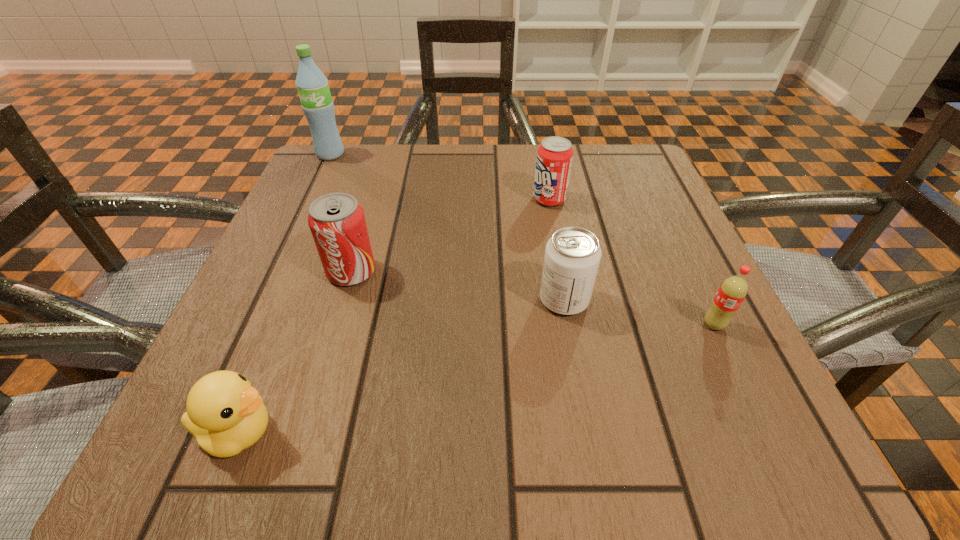
The width and height of the screenshot is (960, 540). Find the location of `free spot between the duck and the water bottle`. free spot between the duck and the water bottle is located at coordinates (284, 293).

This screenshot has width=960, height=540. Find the location of `free space between the nearest object and the tallest object`. free space between the nearest object and the tallest object is located at coordinates (284, 293).

You are a GUI agent. You are given a task and a screenshot of the screen. Output one action in this format:
    pyautogui.click(x=<x>, y=<y>)
    Task: Click on the unoccupied position between the duck and the leftmost soda
    
    Given the screenshot: What is the action you would take?
    pyautogui.click(x=295, y=352)

The width and height of the screenshot is (960, 540). I want to click on vacant area that lies between the rightmost soda and the farthest soda, so 632,262.

The height and width of the screenshot is (540, 960). Find the location of `free space between the tallest object and the rightmost object`. free space between the tallest object and the rightmost object is located at coordinates click(522, 239).

Locate which object ranks fourth in proximity to the leftmost soda. Please provide its 2D coordinates. Your answer should be formatted as a tuple, i.e. [(x, y)], where the tuple contains the x and y coordinates of a point satisfying the conditions above.

[(312, 85)]

Find the location of a particular element. object that stands as the second closest to the water bottle is located at coordinates (554, 157).

Where is `soda identified as the third closest to the rightmost soda`? soda identified as the third closest to the rightmost soda is located at coordinates (337, 222).

This screenshot has height=540, width=960. What are the coordinates of `soda identified as the closest to the leftmost soda` in the screenshot? It's located at (572, 256).

Locate an element on the screen. free space that satisfies the following two spatial constraints: 1. on the front side of the leftmost soda; 2. on the face of the duck is located at coordinates (304, 432).